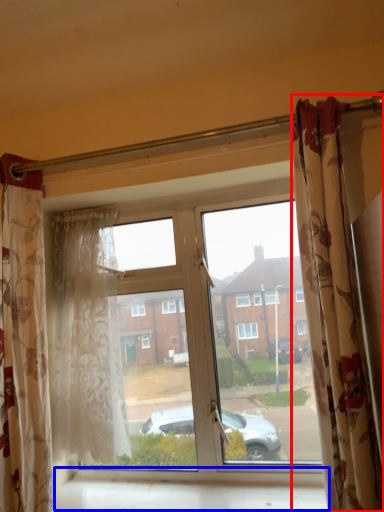
Question: Which point is further to the camera, curtain (highlighted by a red box) or window sill (highlighted by a blue box)?

Choices:
 (A) curtain
 (B) window sill

Answer: (B)